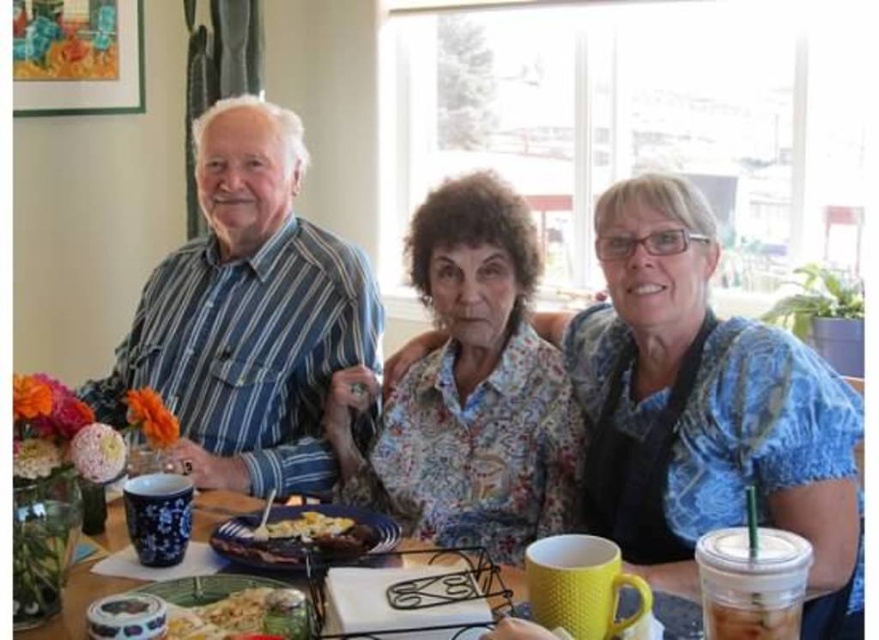
Who is lower down, blue glazed plate at center or yellow matte mug at center?

yellow matte mug at center

Can you confirm if blue glazed plate at center is taller than yellow matte mug at center?

In fact, blue glazed plate at center may be shorter than yellow matte mug at center.

Between point (285, 516) and point (680, 608), which one is positioned behind?

The point (285, 516) is behind.

Identify the location of blue glazed plate at center. (304, 536).

Can you confirm if striped cotton shirt at left is taller than yellow fried egg at center?

Yes.

Who is higher up, striped cotton shirt at left or yellow fried egg at center?

striped cotton shirt at left is higher up.

Is point (335, 253) more distant than point (367, 532)?

Yes.

What are the coordinates of `striped cotton shirt at left` in the screenshot? It's located at (248, 316).

Does point (176, 324) come farther from viewer compared to point (208, 605)?

Yes.

Can you confirm if striped cotton shirt at left is smaller than golden crispy fried chicken at lower left?

No, striped cotton shirt at left is not smaller than golden crispy fried chicken at lower left.

Is point (266, 120) more distant than point (259, 620)?

Yes, point (266, 120) is farther from viewer.

This screenshot has height=640, width=879. Identify the location of striped cotton shirt at left. (248, 316).